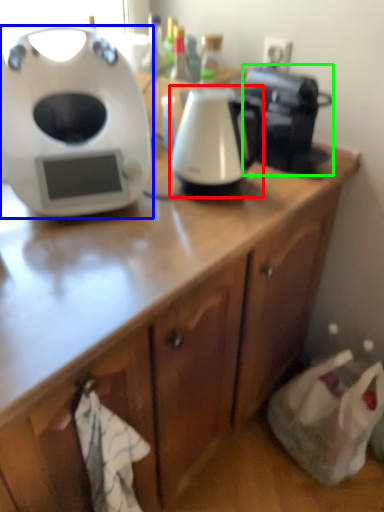
Question: Based on their relative distances, which object is farther from kitchen appliance (highlighted by a red box)? Choose from home appliance (highlighted by a blue box) and coffee maker (highlighted by a green box).

Choices:
 (A) home appliance
 (B) coffee maker

Answer: (A)